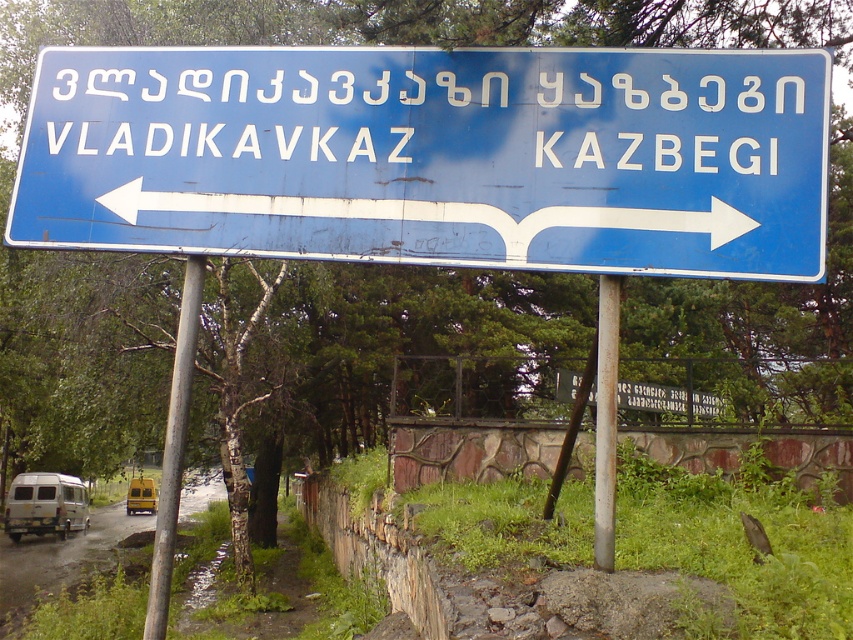
You are driving and see the blue metallic sign at center mounted on the silver metallic pole at center. Can you tell me which object is located above the other?

The blue metallic sign at center is positioned over silver metallic pole at center, so the blue metallic sign at center is above the silver metallic pole at center.

You are a truck driver planning to pass between the metallic pole at left and the silver metallic pole at center. Can you safely navigate through the space between them?

The metallic pole at left might be wider than silver metallic pole at center, so there might not be enough space for the truck to pass safely between them. It is recommended to choose an alternative route or check the exact dimensions before proceeding.